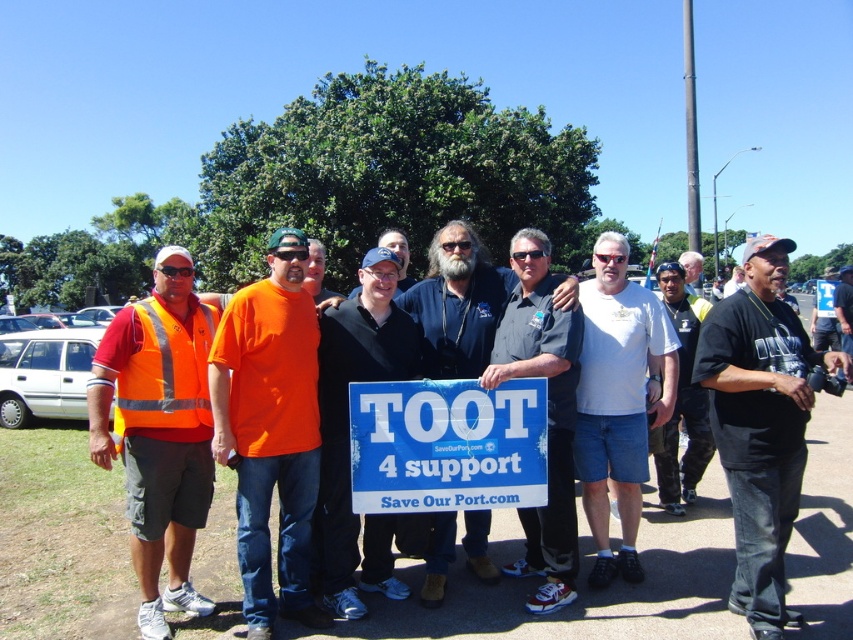
Who is positioned more to the left, blue fabric sign at center or orange safety vest at center?

blue fabric sign at center

Which is in front, point (413, 554) or point (683, 275)?

Point (413, 554) is in front.

Who is more distant from viewer, (500, 301) or (680, 253)?

Positioned behind is point (680, 253).

Locate an element on the screen. The height and width of the screenshot is (640, 853). blue fabric sign at center is located at coordinates (457, 304).

Does blue fabric sign at center appear on the right side of dark blue jeans at center?

Incorrect, blue fabric sign at center is not on the right side of dark blue jeans at center.

This screenshot has height=640, width=853. Describe the element at coordinates (457, 304) in the screenshot. I see `blue fabric sign at center` at that location.

This screenshot has height=640, width=853. Find the location of `blue fabric sign at center`. blue fabric sign at center is located at coordinates (457, 304).

Who is lower down, orange t-shirt at center or black cotton t-shirt at center?

Positioned lower is black cotton t-shirt at center.

Who is more forward, (281, 486) or (805, 406)?

Point (805, 406)

This screenshot has width=853, height=640. Find the location of `orange t-shirt at center`. orange t-shirt at center is located at coordinates (270, 429).